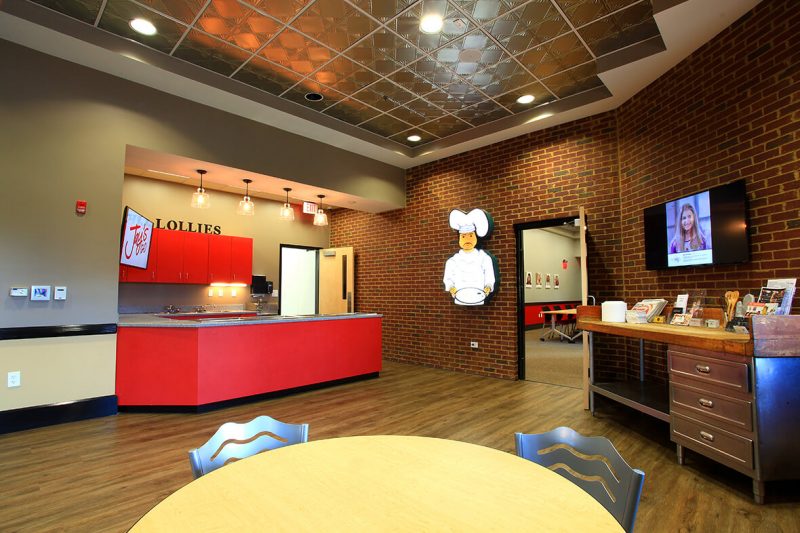
In order to click on wood floor in this screenshot , I will do `click(462, 381)`.